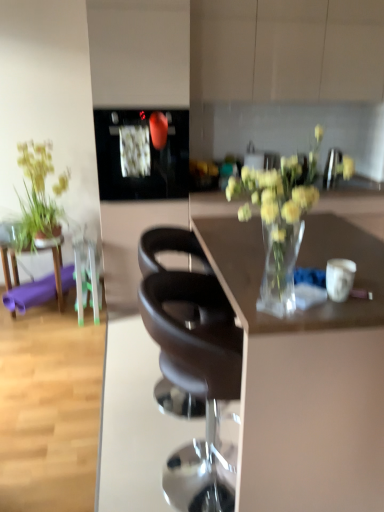
The height and width of the screenshot is (512, 384). I want to click on vacant space underneath translucent glass vase at center (from a real-world perspective), so click(272, 309).